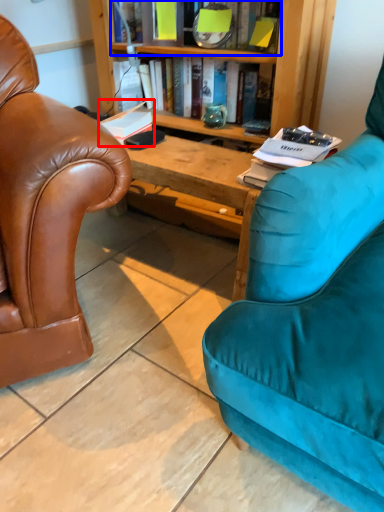
Question: Which object appears closest to the camera in this image, book (highlighted by a red box) or book (highlighted by a blue box)?

Choices:
 (A) book
 (B) book

Answer: (B)